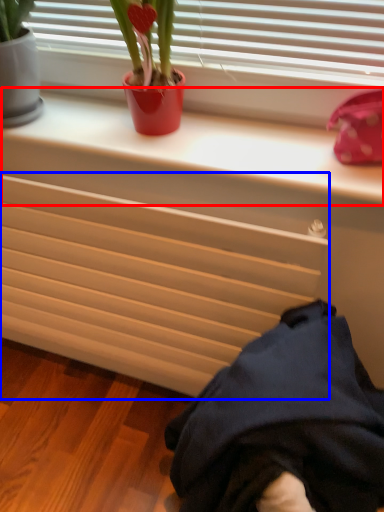
Question: Which object is closer to the camera taking this photo, window sill (highlighted by a red box) or radiator (highlighted by a blue box)?

Choices:
 (A) window sill
 (B) radiator

Answer: (A)